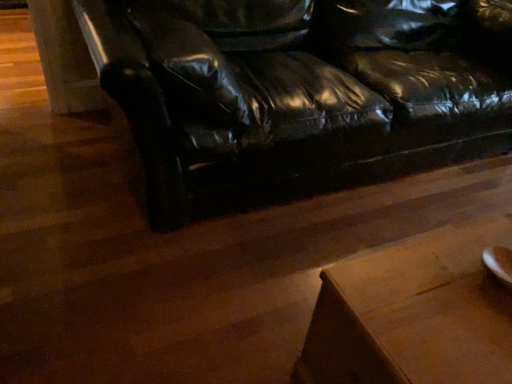
What are the coordinates of `wooden table at lower right` in the screenshot? It's located at (414, 314).

What do you see at coordinates (414, 314) in the screenshot? I see `wooden table at lower right` at bounding box center [414, 314].

Where is `black leather couch at center`? The height and width of the screenshot is (384, 512). black leather couch at center is located at coordinates (298, 92).

This screenshot has width=512, height=384. Describe the element at coordinates (298, 92) in the screenshot. I see `black leather couch at center` at that location.

In order to click on wooden table at lower right in this screenshot , I will do [414, 314].

Can you confirm if black leather couch at center is positioned to the left of wooden table at lower right?

Yes, black leather couch at center is to the left of wooden table at lower right.

Does black leather couch at center lie in front of wooden table at lower right?

No, black leather couch at center is behind wooden table at lower right.

Which is in front, point (458, 22) or point (444, 350)?

The point (444, 350) is in front.

From the image's perspective, which is above, black leather couch at center or wooden table at lower right?

black leather couch at center.

From a real-world perspective, is black leather couch at center on top of wooden table at lower right?

Correct, in the physical world, black leather couch at center is higher than wooden table at lower right.

Which of these two, black leather couch at center or wooden table at lower right, is wider?

black leather couch at center is wider.

Is black leather couch at center shorter than wooden table at lower right?

In fact, black leather couch at center may be taller than wooden table at lower right.

Is black leather couch at center smaller than wooden table at lower right?

Incorrect, black leather couch at center is not smaller in size than wooden table at lower right.

Which is correct: black leather couch at center is inside wooden table at lower right, or outside of it?

black leather couch at center lies outside wooden table at lower right.

Is black leather couch at center not close to wooden table at lower right?

No.

Is black leather couch at center aimed at wooden table at lower right?

Yes, black leather couch at center faces towards wooden table at lower right.

What's the angular difference between black leather couch at center and wooden table at lower right's facing directions?

They differ by 0.000678 degrees in their facing directions.

Where is `table that appears in front of the black leather couch at center`? This screenshot has width=512, height=384. table that appears in front of the black leather couch at center is located at coordinates (414, 314).

Can you confirm if wooden table at lower right is positioned to the left of black leather couch at center?

In fact, wooden table at lower right is to the right of black leather couch at center.

Is wooden table at lower right in front of black leather couch at center?

Yes, the depth of wooden table at lower right is less than that of black leather couch at center.

Between point (470, 292) and point (282, 22), which one is positioned in front?

Point (470, 292)

From the image's perspective, is wooden table at lower right located above or below black leather couch at center?

Clearly, from the image's perspective, wooden table at lower right is below black leather couch at center.

From a real-world perspective, is wooden table at lower right beneath black leather couch at center?

Yes.

Is wooden table at lower right thinner than black leather couch at center?

Yes, wooden table at lower right is thinner than black leather couch at center.

Does wooden table at lower right have a greater height compared to black leather couch at center?

No, wooden table at lower right is not taller than black leather couch at center.

Considering the relative sizes of wooden table at lower right and black leather couch at center in the image provided, is wooden table at lower right bigger than black leather couch at center?

No.

Do you think wooden table at lower right is within black leather couch at center, or outside of it?

The correct answer is: outside.

Based on the photo, is wooden table at lower right touching black leather couch at center?

wooden table at lower right is not next to black leather couch at center, and they're not touching.

Is wooden table at lower right oriented towards black leather couch at center?

No, wooden table at lower right is not turned towards black leather couch at center.

This screenshot has height=384, width=512. I want to click on studio couch on the left of wooden table at lower right, so click(298, 92).

Where is `table in front of the black leather couch at center`? This screenshot has width=512, height=384. table in front of the black leather couch at center is located at coordinates (414, 314).

Where is `studio couch behind the wooden table at lower right`? studio couch behind the wooden table at lower right is located at coordinates (298, 92).